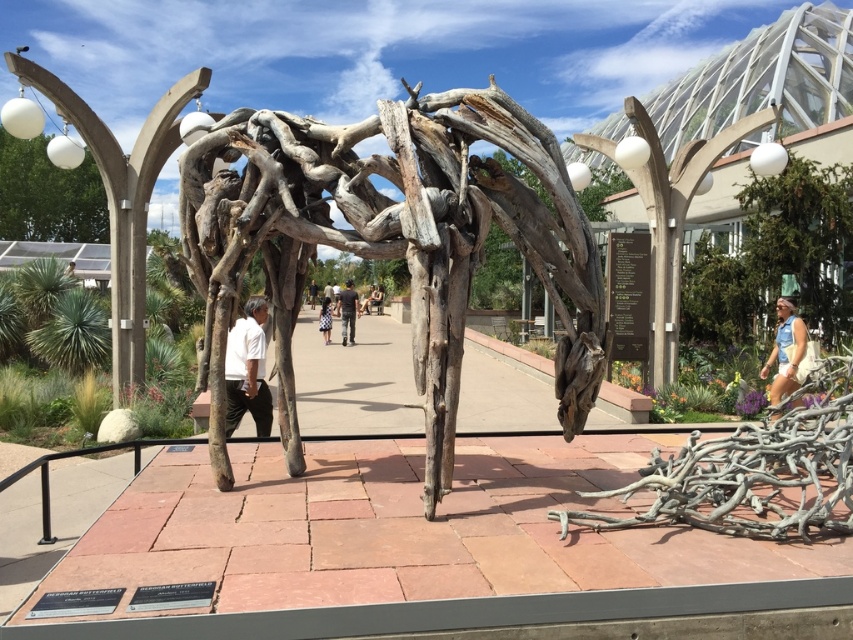
Can you confirm if driftwood sculpture at center is positioned below dark brown leather jacket at center?

Indeed, driftwood sculpture at center is positioned under dark brown leather jacket at center.

Can you confirm if driftwood sculpture at center is positioned above dark brown leather jacket at center?

No, driftwood sculpture at center is not above dark brown leather jacket at center.

Is point (448, 456) in front of point (352, 314)?

That is True.

The image size is (853, 640). I want to click on driftwood sculpture at center, so click(409, 227).

From the picture: Can you confirm if dark brown leather jacket at center is positioned to the left of light brown wooden stick at center?

Correct, you'll find dark brown leather jacket at center to the left of light brown wooden stick at center.

Does dark brown leather jacket at center have a greater height compared to light brown wooden stick at center?

Yes.

Does point (354, 326) come behind point (358, 314)?

That is False.

Find the location of `dark brown leather jacket at center`. dark brown leather jacket at center is located at coordinates (347, 310).

Between point (767, 369) and point (325, 300), which one is positioned behind?

The point (325, 300) is behind.

Between denim shorts at lower right and white cotton shirt at center, which one appears on the left side from the viewer's perspective?

white cotton shirt at center

What do you see at coordinates (785, 352) in the screenshot?
I see `denim shorts at lower right` at bounding box center [785, 352].

Find the location of a particular element. Image resolution: width=853 pixels, height=640 pixels. denim shorts at lower right is located at coordinates (785, 352).